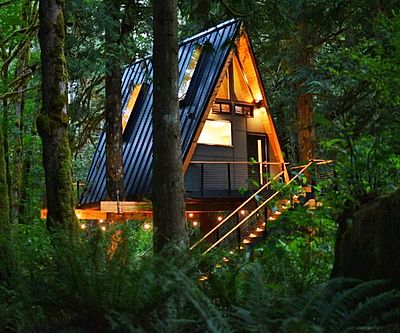
This screenshot has height=333, width=400. I want to click on sky lights, so click(x=189, y=87), click(x=136, y=96).